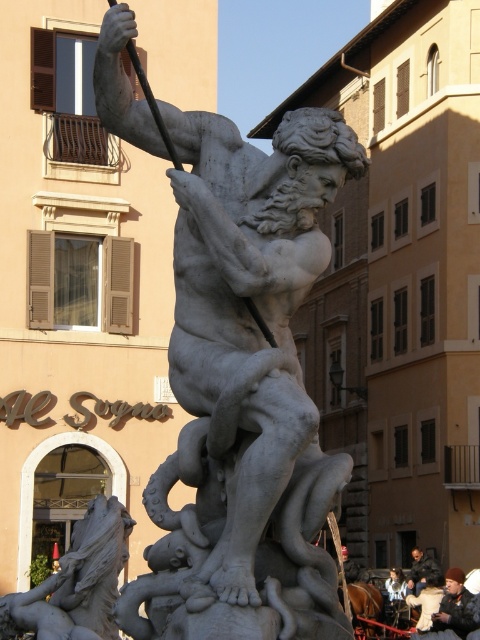
Does white marble statue at center appear on the right side of dark brown leather jacket at lower right?

No, white marble statue at center is not to the right of dark brown leather jacket at lower right.

Is white marble statue at center thinner than dark brown leather jacket at lower right?

Incorrect, white marble statue at center's width is not less than dark brown leather jacket at lower right's.

This screenshot has width=480, height=640. Find the location of `white marble statue at center`. white marble statue at center is located at coordinates pos(245,388).